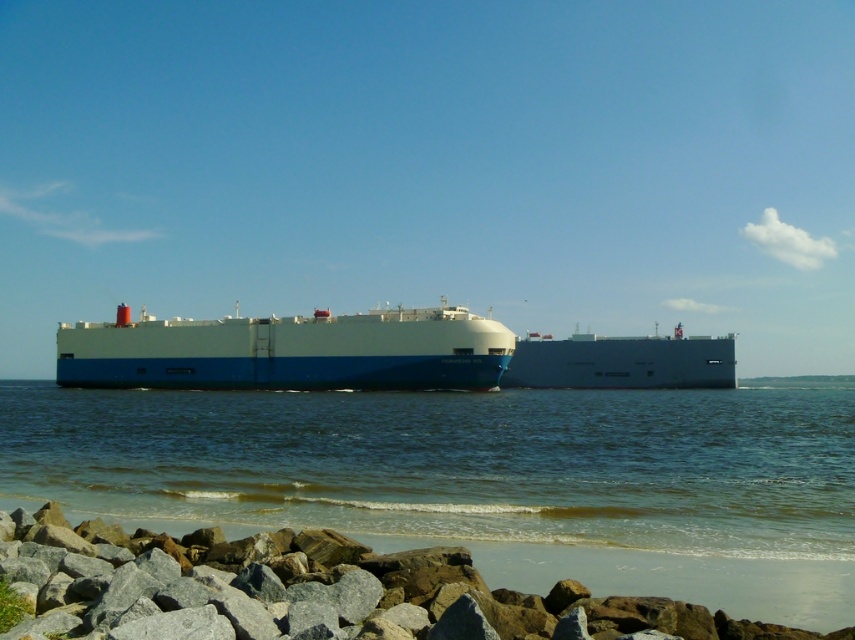
You are standing on the rocky beach and want to take a photo of the blue water at center and the blue matte cargo ship at center. Which object will appear larger in your photo?

The blue water at center will appear larger in your photo because it is closer to you than the blue matte cargo ship at center.

You are standing on the rocky beach in the foreground of the coastal scene. You see a point marked at coordinates (482, 480). Based on the scene description, can you determine what surface this point is located on?

The point at coordinates (482, 480) is on blue water at center, so it is located on the calm water surface in the middle ground of the coastal scene.